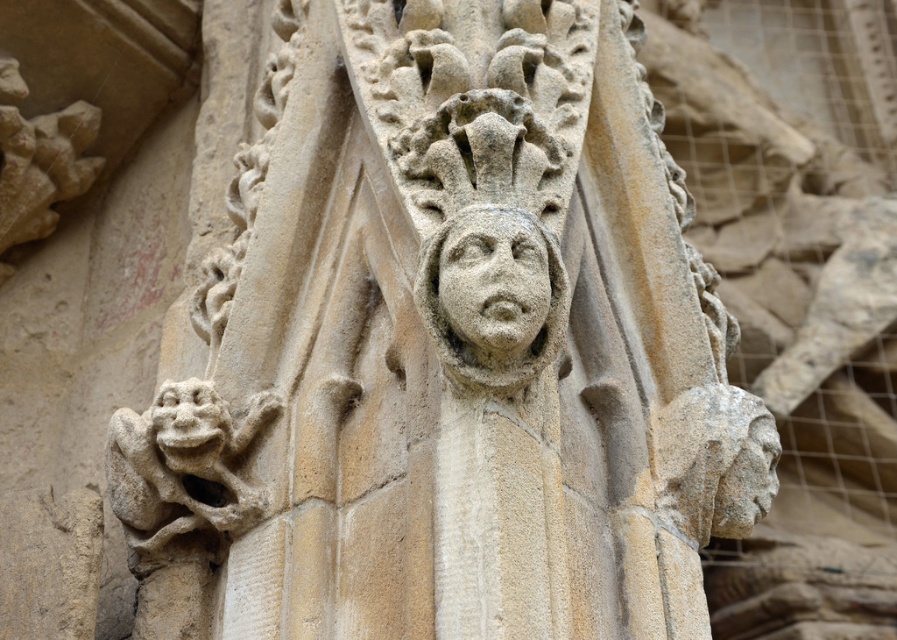
You are standing in front of an ancient stone carving and notice a specific point marked at coordinates point (246, 484). If you want to touch this point with your hand, which is about 0.2 meters long, will you be able to reach it without moving closer?

The point (246, 484) is 37.58 meters away from the camera. Since your hand is only 0.2 meters long, you cannot reach it without moving closer.

You are an architect examining the stone architectural detail. You need to locate the stone textured gargoyle at lower left. According to the coordinates provided, where exactly is it positioned?

The stone textured gargoyle at lower left is positioned at coordinates point (183, 474).

You are an architect examining the stone details of a cathedral. You notice the stone textured gargoyle at lower left and the stone carved face at center. Which of these two objects is taller?

The stone textured gargoyle at lower left is much taller than the stone carved face at center.